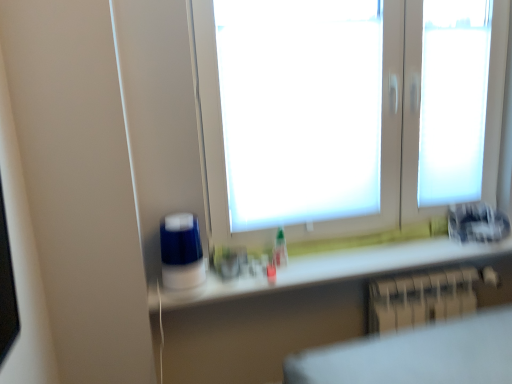
Question: Is metallic silver radiator at lower right at the left side of white matte window at center?

Choices:
 (A) no
 (B) yes

Answer: (A)

Question: Does metallic silver radiator at lower right contain white matte window at center?

Choices:
 (A) no
 (B) yes

Answer: (A)

Question: Considering the relative sizes of metallic silver radiator at lower right and white matte window at center in the image provided, is metallic silver radiator at lower right wider than white matte window at center?

Choices:
 (A) no
 (B) yes

Answer: (B)

Question: From a real-world perspective, does metallic silver radiator at lower right sit lower than white matte window at center?

Choices:
 (A) yes
 (B) no

Answer: (A)

Question: Can you confirm if metallic silver radiator at lower right is bigger than white matte window at center?

Choices:
 (A) no
 (B) yes

Answer: (A)

Question: Considering the relative sizes of metallic silver radiator at lower right and white matte window at center in the image provided, is metallic silver radiator at lower right thinner than white matte window at center?

Choices:
 (A) no
 (B) yes

Answer: (A)

Question: Is metallic silver radiator at lower right bigger than white glossy counter top at lower center?

Choices:
 (A) no
 (B) yes

Answer: (B)

Question: Does metallic silver radiator at lower right have a greater width compared to white glossy counter top at lower center?

Choices:
 (A) yes
 (B) no

Answer: (B)

Question: Would you say metallic silver radiator at lower right contains white glossy counter top at lower center?

Choices:
 (A) yes
 (B) no

Answer: (B)

Question: From the image's perspective, is metallic silver radiator at lower right located above white glossy counter top at lower center?

Choices:
 (A) yes
 (B) no

Answer: (B)

Question: From a real-world perspective, does metallic silver radiator at lower right stand above white glossy counter top at lower center?

Choices:
 (A) no
 (B) yes

Answer: (A)

Question: Is the depth of metallic silver radiator at lower right less than that of white glossy counter top at lower center?

Choices:
 (A) yes
 (B) no

Answer: (B)

Question: Is white glossy counter top at lower center positioned far away from white matte window at center?

Choices:
 (A) no
 (B) yes

Answer: (A)